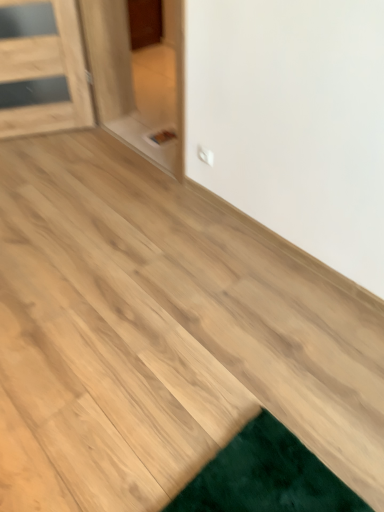
This screenshot has height=512, width=384. In order to click on free point above natural wood floor at center (from a real-world perspective) in this screenshot , I will do `click(175, 357)`.